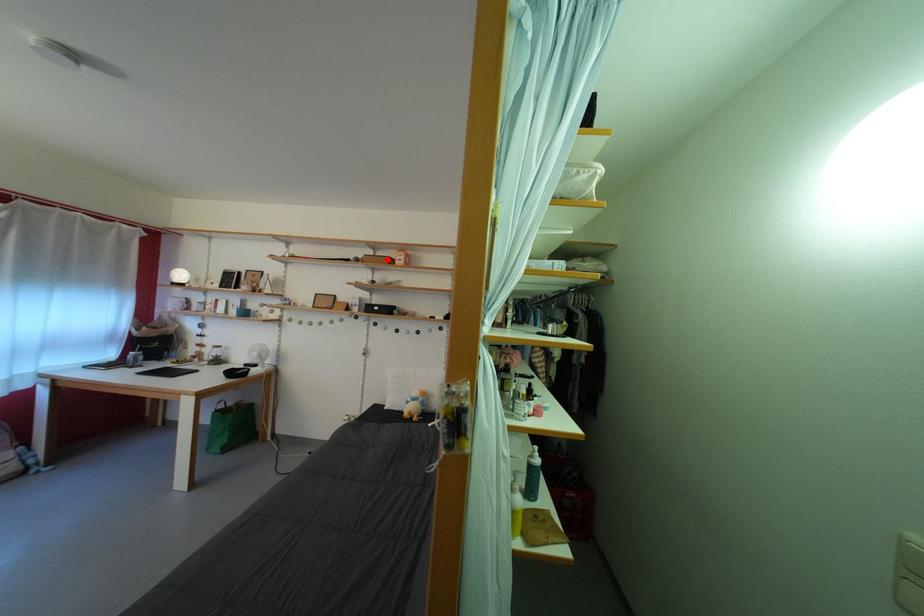
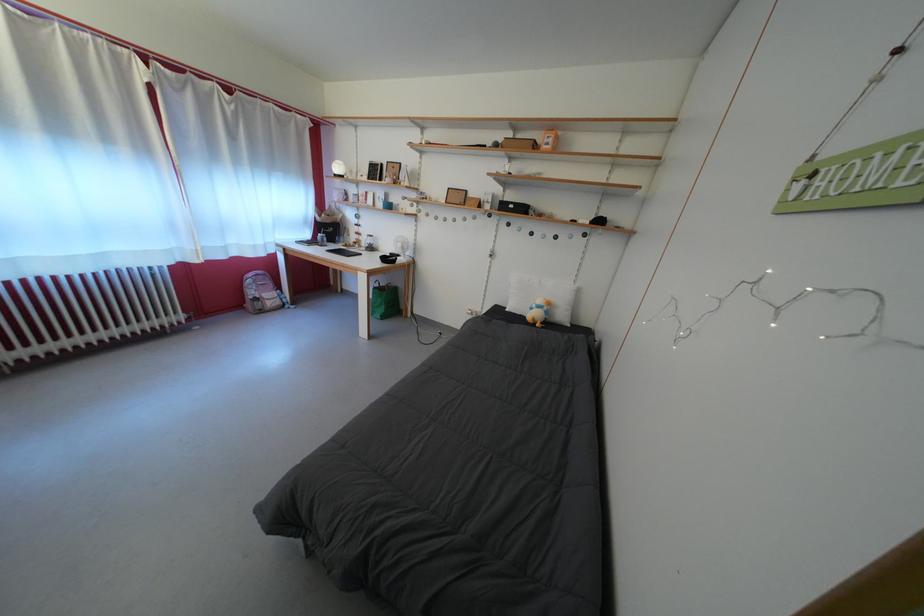
Where in the second image is the point corresponding to the highlighted location from the first image?

(527, 142)